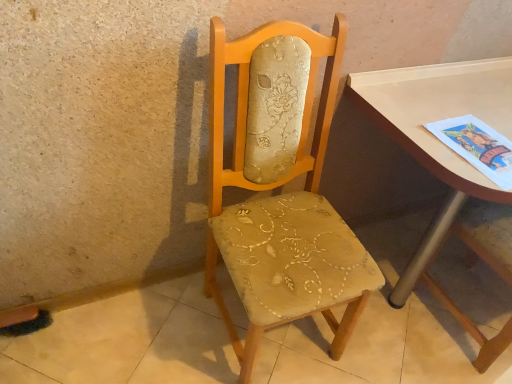
This screenshot has height=384, width=512. I want to click on matte white table at right, so click(434, 136).

You are a GUI agent. You are given a task and a screenshot of the screen. Output one action in this format:
    pyautogui.click(x=<x>, y=<y>)
    Task: Click on the matte beige fabric chair at center
    This screenshot has width=512, height=384.
    Given the screenshot: What is the action you would take?
    pyautogui.click(x=281, y=185)

At what (x,y) coordinates should I click in order to perform the action: click on beige fabric chair at center. Please return your answer as a coordinate pair (x, y). This screenshot has height=384, width=512. Looking at the image, I should click on (128, 341).

Looking at this image, which is more to the left, beige fabric chair at center or matte white table at right?

From the viewer's perspective, beige fabric chair at center appears more on the left side.

From a real-world perspective, is beige fabric chair at center beneath matte white table at right?

Yes, from a real-world perspective, beige fabric chair at center is below matte white table at right.

This screenshot has height=384, width=512. Find the location of `concrete in front of the matte white table at right`. concrete in front of the matte white table at right is located at coordinates (128, 341).

In the scene shown: Is beige fabric chair at center not near matte white table at right?

No, beige fabric chair at center is not far away from matte white table at right.

Is matte white table at right oriented towards matte beige fabric chair at center?

No.

Is matte white table at right not within matte beige fabric chair at center?

Yes, matte white table at right is not within matte beige fabric chair at center.

Consider the image. Is matte white table at right taller than matte beige fabric chair at center?

In fact, matte white table at right may be shorter than matte beige fabric chair at center.

Is matte white table at right to the left or to the right of matte beige fabric chair at center in the image?

In the image, matte white table at right appears on the right side of matte beige fabric chair at center.

Considering the relative sizes of matte beige fabric chair at center and matte white table at right in the image provided, is matte beige fabric chair at center shorter than matte white table at right?

In fact, matte beige fabric chair at center may be taller than matte white table at right.

In the image, is matte beige fabric chair at center positioned in front of or behind matte white table at right?

matte beige fabric chair at center is in front of matte white table at right.

Looking at this image, from a real-world perspective, is matte beige fabric chair at center positioned above or below matte white table at right?

Clearly, from a real-world perspective, matte beige fabric chair at center is above matte white table at right.

How far apart are matte beige fabric chair at center and matte white table at right?

matte beige fabric chair at center and matte white table at right are 16.29 inches apart.

From a real-world perspective, is matte white table at right under beige fabric chair at center?

No.

Which object is wider, matte white table at right or beige fabric chair at center?

With larger width is beige fabric chair at center.

Is point (374, 89) behind point (97, 357)?

No, it is in front of (97, 357).

Identify the location of table above the beige fabric chair at center (from the image's perspective). This screenshot has width=512, height=384. (434, 136).

From the image's perspective, is matte beige fabric chair at center above or below beige fabric chair at center?

Clearly, from the image's perspective, matte beige fabric chair at center is above beige fabric chair at center.

From the picture: Is matte beige fabric chair at center positioned with its back to beige fabric chair at center?

matte beige fabric chair at center does not have its back to beige fabric chair at center.

Where is `chair in front of the beige fabric chair at center`? The height and width of the screenshot is (384, 512). chair in front of the beige fabric chair at center is located at coordinates (281, 185).

In order to click on concrete located below the matte beige fabric chair at center (from the image's perspective) in this screenshot , I will do `click(128, 341)`.

Does beige fabric chair at center have a smaller size compared to matte beige fabric chair at center?

Correct, beige fabric chair at center occupies less space than matte beige fabric chair at center.

Is matte beige fabric chair at center located within beige fabric chair at center?

No, matte beige fabric chair at center is not a part of beige fabric chair at center.

Consider the image. Considering the relative positions of beige fabric chair at center and matte beige fabric chair at center in the image provided, is beige fabric chair at center to the right of matte beige fabric chair at center from the viewer's perspective?

Yes.

This screenshot has height=384, width=512. I want to click on concrete in front of the matte white table at right, so click(128, 341).

The height and width of the screenshot is (384, 512). I want to click on table on the right of matte beige fabric chair at center, so click(x=434, y=136).

Estimate the real-world distances between objects in this image. Which object is closer to matte white table at right, matte beige fabric chair at center or beige fabric chair at center?

Among the two, matte beige fabric chair at center is located nearer to matte white table at right.

Considering their positions, is matte beige fabric chair at center positioned further to beige fabric chair at center than matte white table at right?

matte white table at right.

Estimate the real-world distances between objects in this image. Which object is further from beige fabric chair at center, matte white table at right or matte beige fabric chair at center?

matte white table at right.

When comparing their distances from matte white table at right, does beige fabric chair at center or matte beige fabric chair at center seem further?

beige fabric chair at center is positioned further to the anchor matte white table at right.

Which object lies further to the anchor point matte beige fabric chair at center, beige fabric chair at center or matte white table at right?

The object further to matte beige fabric chair at center is beige fabric chair at center.

Looking at the image, which one is located closer to matte beige fabric chair at center, matte white table at right or beige fabric chair at center?

Among the two, matte white table at right is located nearer to matte beige fabric chair at center.

Find the location of `concrete situated between matte beige fabric chair at center and matte white table at right from left to right`. concrete situated between matte beige fabric chair at center and matte white table at right from left to right is located at coordinates (128, 341).